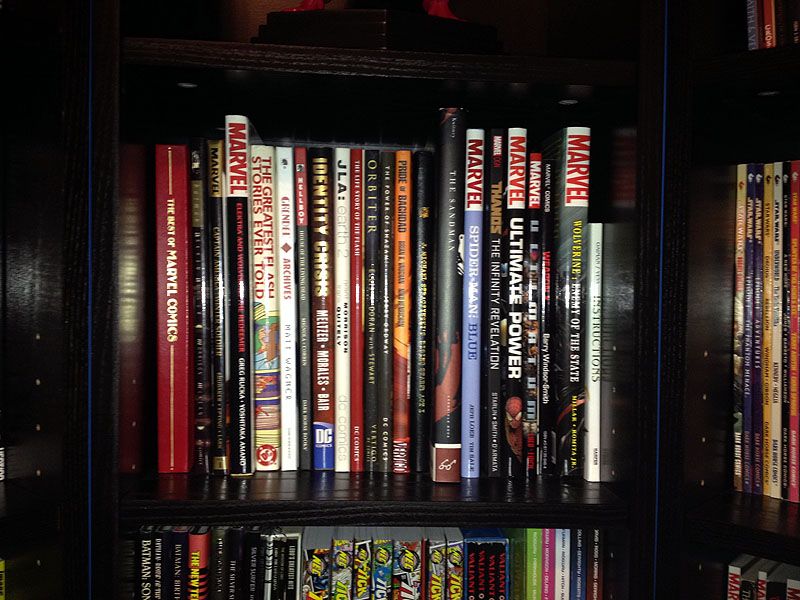
The image size is (800, 600). Find the location of `shelf walls`. shelf walls is located at coordinates (46, 264), (130, 253), (624, 258), (708, 264).